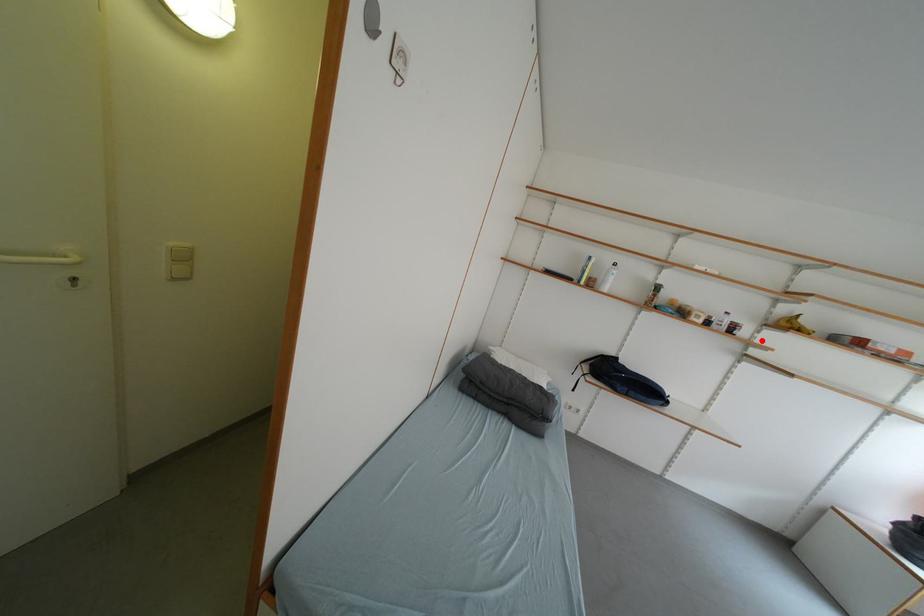
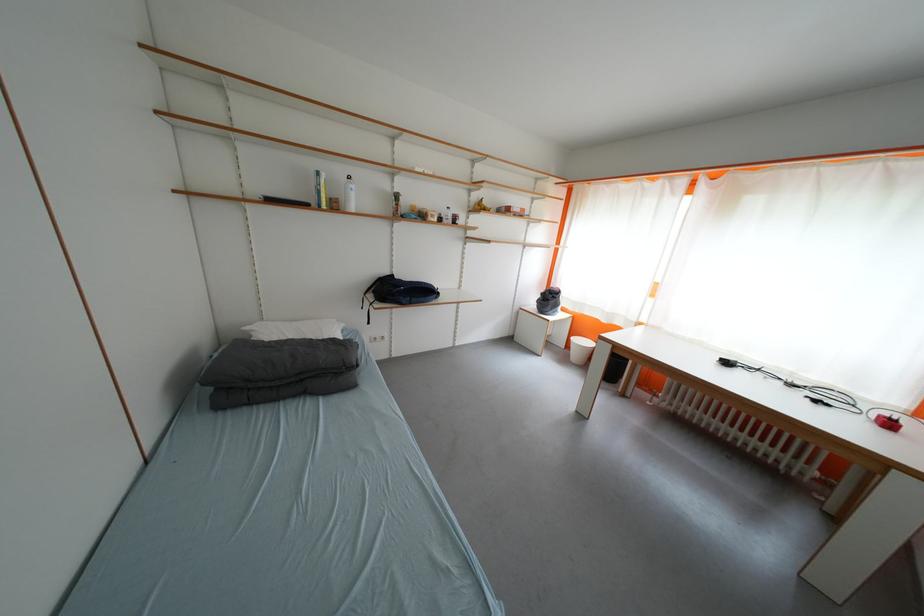
Question: I am providing you with two images of the same scene from different viewpoints. In image1, a red point is highlighted. Considering the same 3D point in image2, which of the following is correct?

Choices:
 (A) It is closer
 (B) It is farther

Answer: (A)